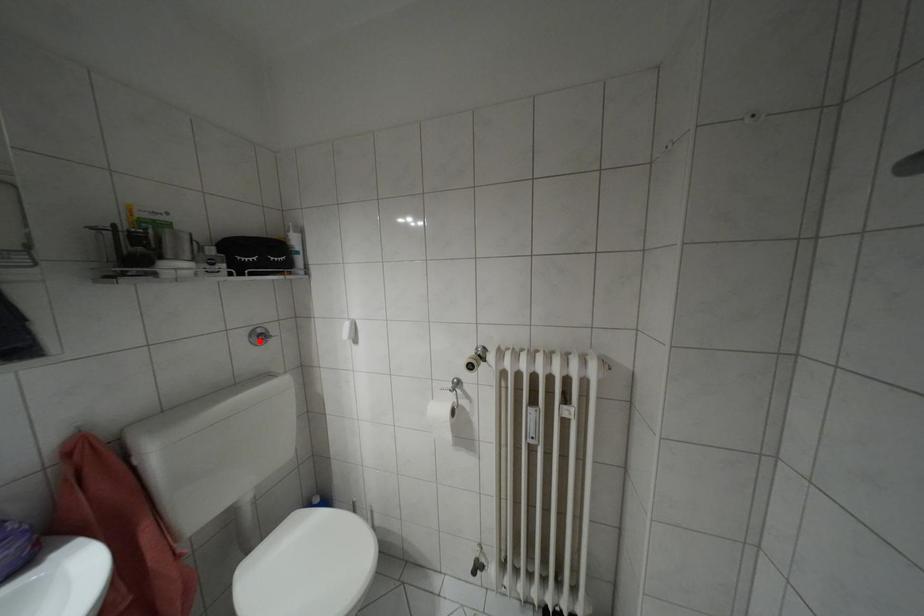
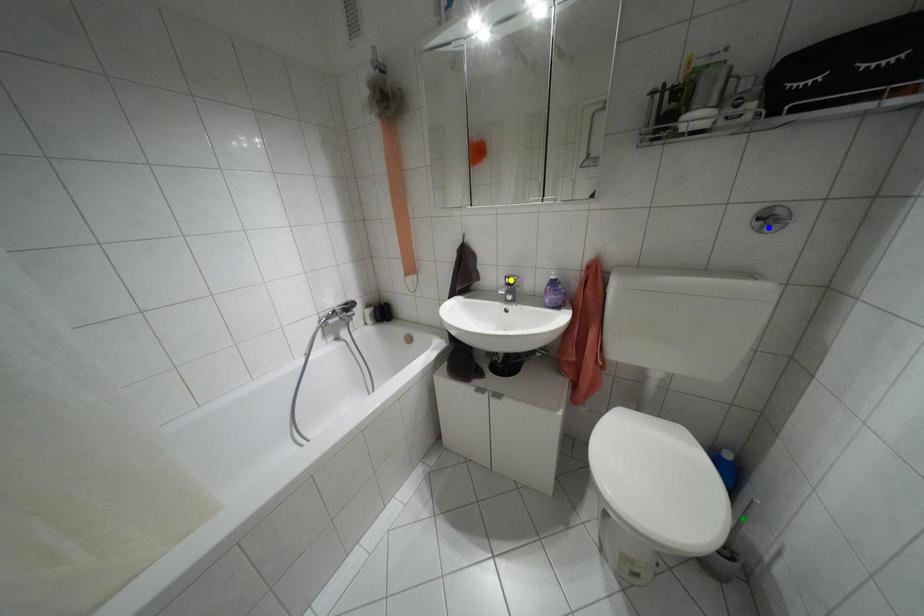
Question: I am providing you with two images of the same scene from different viewpoints. A red point is marked on the first image. You are given multiple points on the second image. Which point in image 2 represents the same 3d spot as the red point in image 1?

Choices:
 (A) yellow point
 (B) blue point
 (C) green point

Answer: (B)